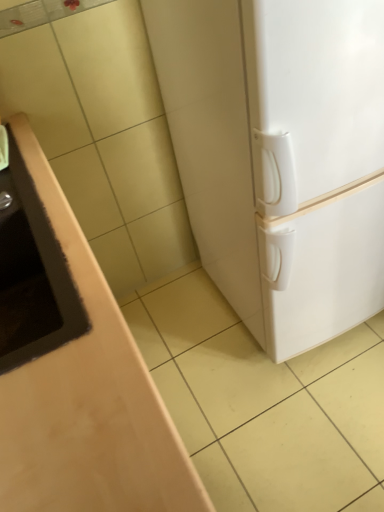
Question: Does point [23, 295] appear closer or farther from the camera than point [269, 177]?

Choices:
 (A) farther
 (B) closer

Answer: (A)

Question: From their relative heights in the image, would you say matte brown sink at left is taller or shorter than white matte refrigerator at right?

Choices:
 (A) short
 (B) tall

Answer: (A)

Question: Is matte brown sink at left spatially inside white matte refrigerator at right, or outside of it?

Choices:
 (A) outside
 (B) inside

Answer: (A)

Question: Is white matte refrigerator at right inside or outside of matte brown sink at left?

Choices:
 (A) inside
 (B) outside

Answer: (B)

Question: From the image's perspective, is white matte refrigerator at right above or below matte brown sink at left?

Choices:
 (A) above
 (B) below

Answer: (A)

Question: In the image, is white matte refrigerator at right positioned in front of or behind matte brown sink at left?

Choices:
 (A) front
 (B) behind

Answer: (B)

Question: Based on their sizes in the image, would you say white matte refrigerator at right is bigger or smaller than matte brown sink at left?

Choices:
 (A) big
 (B) small

Answer: (A)